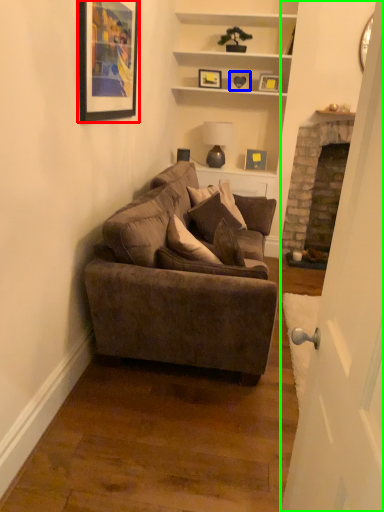
Question: Estimate the real-world distances between objects in this image. Which object is closer to picture frame (highlighted by a red box), picture frame (highlighted by a blue box) or door (highlighted by a green box)?

Choices:
 (A) picture frame
 (B) door

Answer: (B)